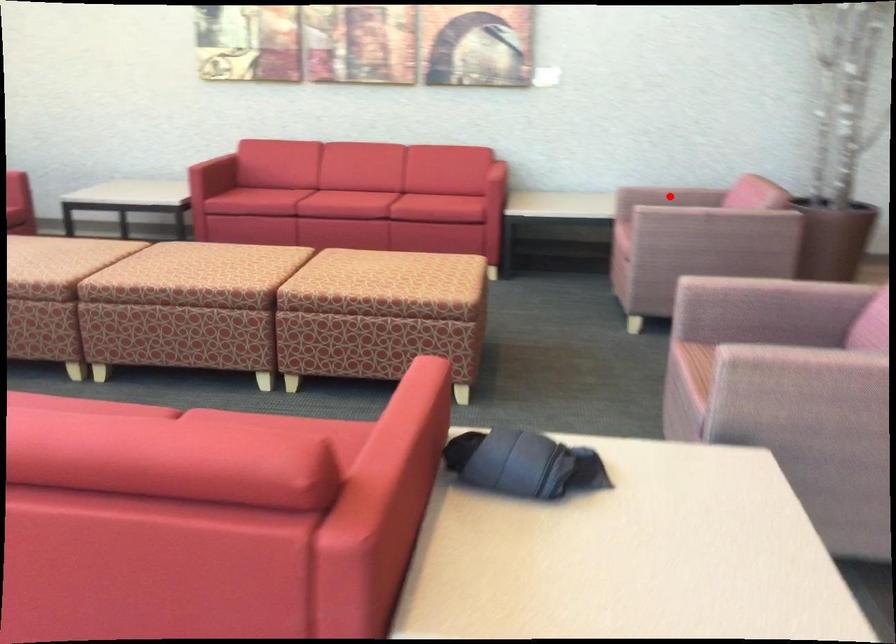
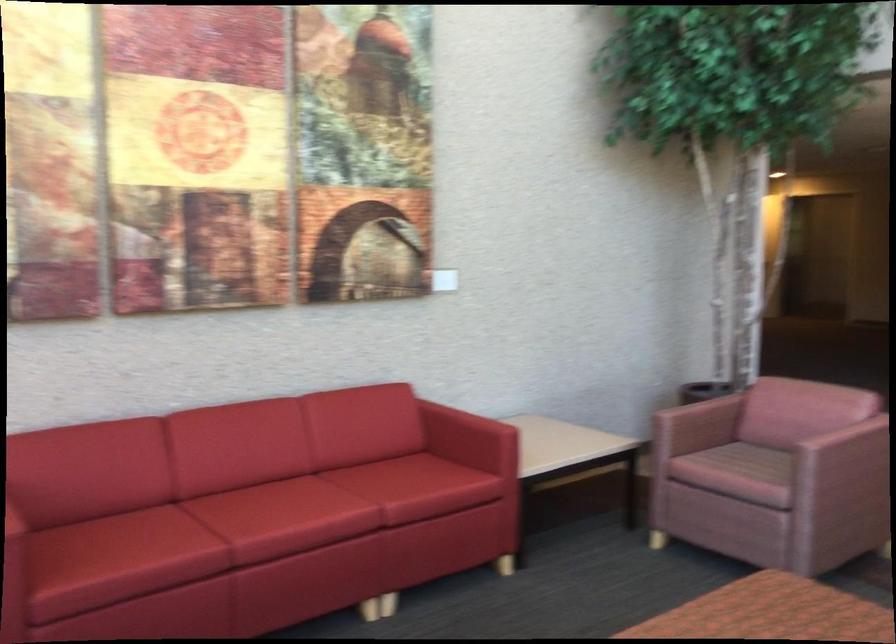
Question: I am providing you with two images of the same scene from different viewpoints. A red point is marked on the first image. At the location where the point appears in image 1, is it still visible in image 2?

Choices:
 (A) Yes
 (B) No

Answer: (B)